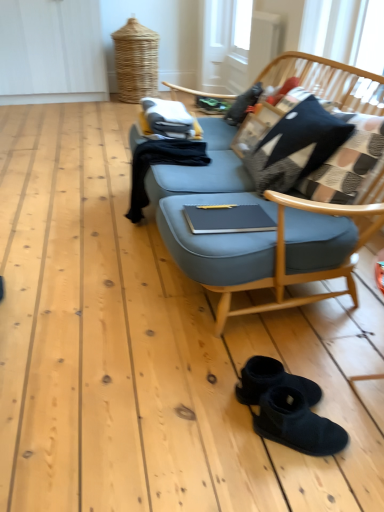
Question: From a real-world perspective, relative to plaid fabric pillow at upper right, is black suede boots at lower center vertically above or below?

Choices:
 (A) above
 (B) below

Answer: (B)

Question: Looking at the image, does black suede boots at lower center seem bigger or smaller compared to plaid fabric pillow at upper right?

Choices:
 (A) small
 (B) big

Answer: (A)

Question: Is black suede boots at lower center taller or shorter than plaid fabric pillow at upper right?

Choices:
 (A) short
 (B) tall

Answer: (A)

Question: From the image's perspective, relative to black suede boots at lower center, is plaid fabric pillow at upper right above or below?

Choices:
 (A) below
 (B) above

Answer: (B)

Question: Looking at the image, does plaid fabric pillow at upper right seem bigger or smaller compared to black suede boots at lower center?

Choices:
 (A) small
 (B) big

Answer: (B)

Question: From their relative heights in the image, would you say plaid fabric pillow at upper right is taller or shorter than black suede boots at lower center?

Choices:
 (A) short
 (B) tall

Answer: (B)

Question: From a real-world perspective, is plaid fabric pillow at upper right positioned above or below black suede boots at lower center?

Choices:
 (A) below
 (B) above

Answer: (B)